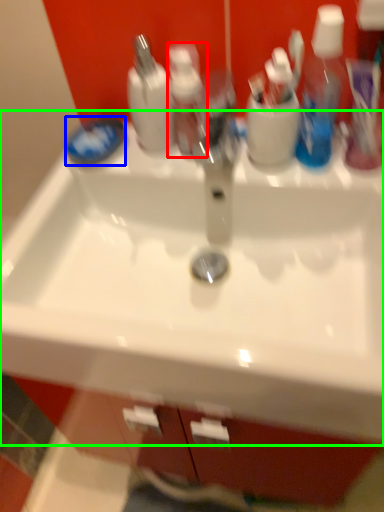
Question: Estimate the real-world distances between objects in this image. Which object is farther from toiletry (highlighted by a red box), soap (highlighted by a blue box) or sink (highlighted by a green box)?

Choices:
 (A) soap
 (B) sink

Answer: (B)